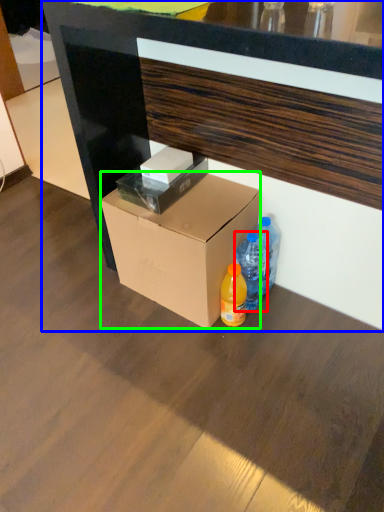
Question: Which object is the farthest from bottle (highlighted by a red box)? Choose among these: desk (highlighted by a blue box) or box (highlighted by a green box).

Choices:
 (A) desk
 (B) box

Answer: (A)